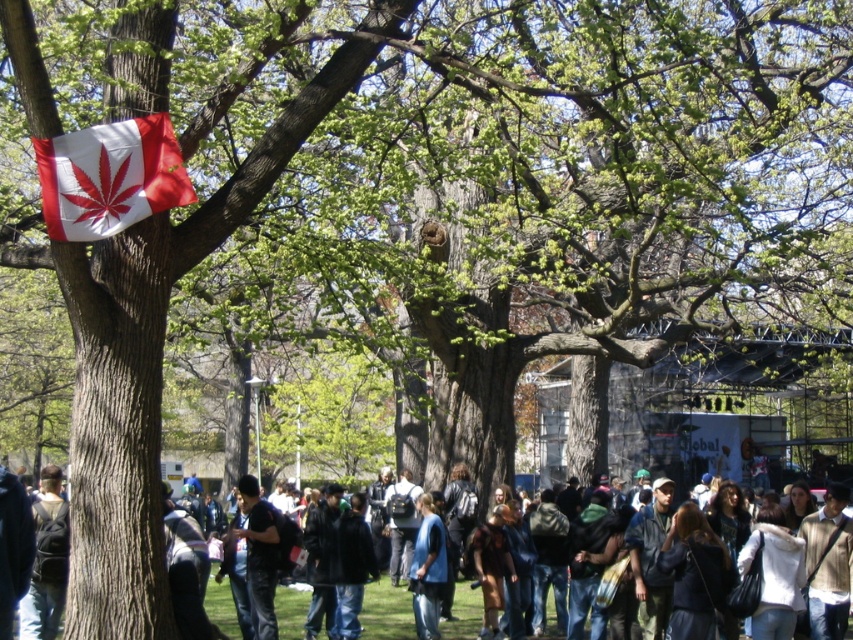
You are a photographer setting up a tripod in the park. You need to decide where to place your equipment so that it doesn not block the view of the white fabric flag at upper left and the dark blue jeans at lower left. Which object is narrower and thus requires less space between the tripod and the object to avoid blocking it?

The white fabric flag at upper left is thinner than the dark blue jeans at lower left, so it requires less space between the tripod and the object to avoid blocking it.

You are an event organizer planning to replace the white fabric flag at upper left with a larger one. Considering the space available, would the new flag be bigger than the dark gray fabric jacket at center?

The white fabric flag at upper left currently occupies less space than the dark gray fabric jacket at center. If you replace it with a larger flag, it might exceed the jacket in size, but this depends on the available space. However, based on the current description, the original flag is smaller. Please ensure the new flag doesn

You are standing in the park scene described. You see a point marked at coordinates (109, 177). What object is located at this point?

The point at coordinates (109, 177) indicates the white fabric flag at upper left.